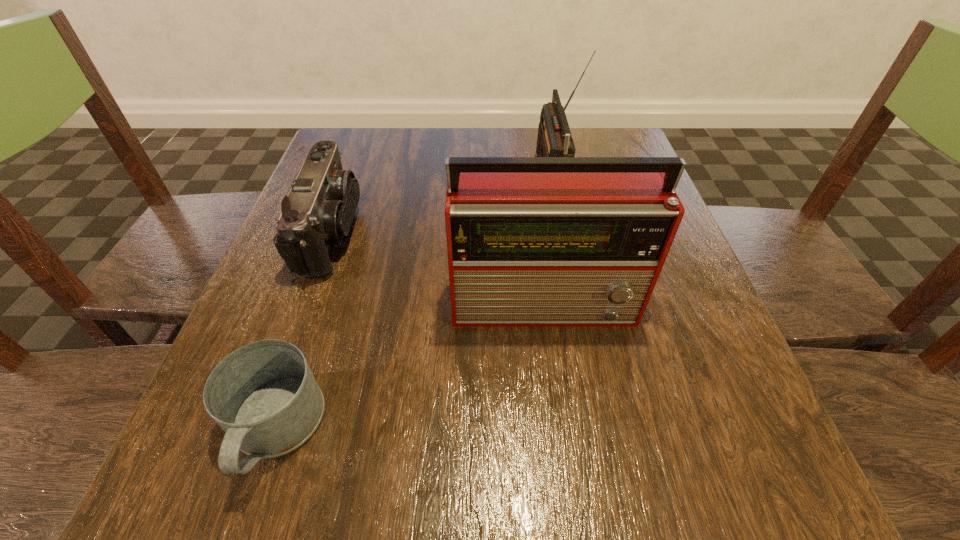
Find the location of a particular element. This screenshot has height=540, width=960. object at the far edge is located at coordinates (554, 139).

Identify the location of object located in the near edge section of the desktop. point(264,396).

The width and height of the screenshot is (960, 540). I want to click on camcorder present at the left edge, so click(x=318, y=212).

In order to click on mug that is at the left edge in this screenshot , I will do `click(264, 396)`.

Find the location of a particular element. object that is positioned at the right edge is located at coordinates (532, 241).

Locate an element on the screen. object at the near left corner is located at coordinates (264, 396).

You are a GUI agent. You are given a task and a screenshot of the screen. Output one action in this format:
    pyautogui.click(x=<x>, y=<y>)
    Task: Click on the vacant space at the far edge of the desktop
    
    Given the screenshot: What is the action you would take?
    pyautogui.click(x=425, y=132)

In the image, there is a desktop. Where is `vacant space at the near edge`? vacant space at the near edge is located at coordinates (401, 480).

In the image, there is a desktop. Identify the location of vacant area at the left edge. This screenshot has width=960, height=540. (334, 272).

In the image, there is a desktop. Where is `vacant space at the right edge`? This screenshot has width=960, height=540. vacant space at the right edge is located at coordinates (678, 274).